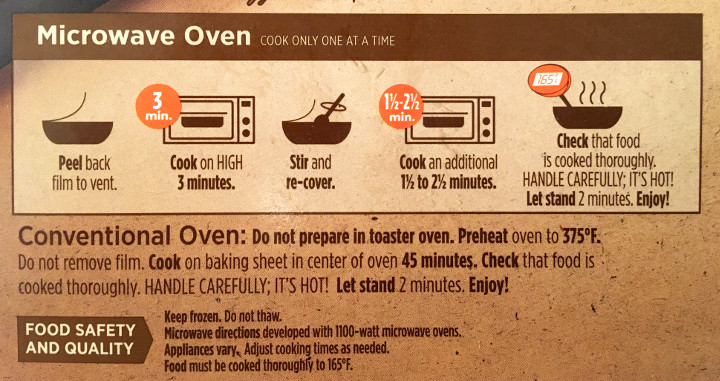
This screenshot has width=720, height=381. I want to click on bowl, so click(86, 129), click(320, 127), click(564, 116).